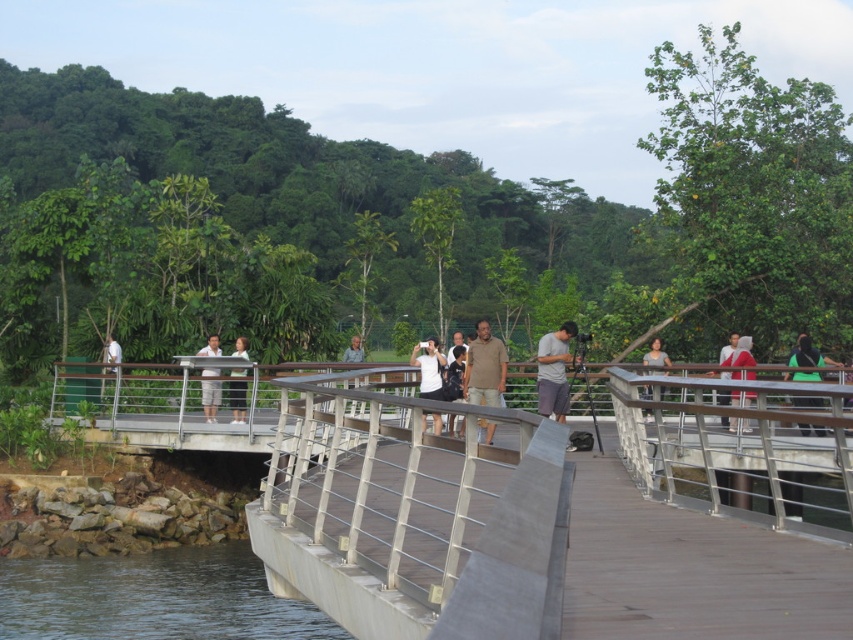
Question: Does white matte shirt at center have a lesser width compared to green matte shirt at upper right?

Choices:
 (A) yes
 (B) no

Answer: (A)

Question: Which of the following is the closest to the observer?

Choices:
 (A) (242, 550)
 (B) (119, 353)
 (C) (422, 353)

Answer: (A)

Question: Can you confirm if clear water at lower left is positioned to the left of white matte shirt at center?

Choices:
 (A) yes
 (B) no

Answer: (A)

Question: Which point is closer to the camera?

Choices:
 (A) (486, 400)
 (B) (648, 364)

Answer: (A)

Question: Which object is closer to the camera taking this photo?

Choices:
 (A) green matte shirt at upper right
 (B) clear water at lower left

Answer: (B)

Question: Is light brown shirt at center in front of red fabric shirt at center?

Choices:
 (A) yes
 (B) no

Answer: (B)